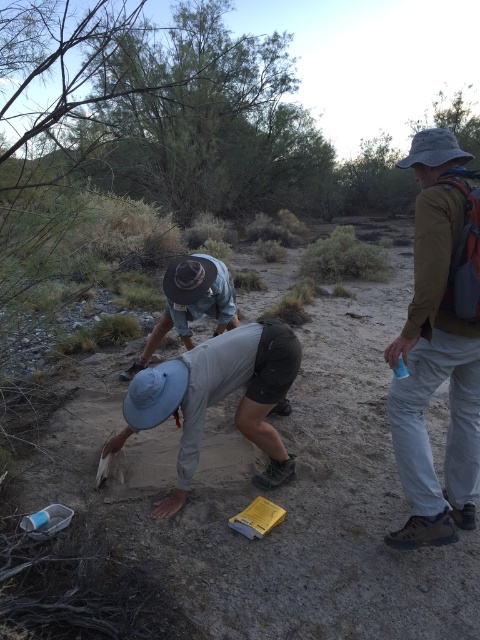
Question: Which point appears farthest from the camera in this image?

Choices:
 (A) (134, 392)
 (B) (176, 266)
 (C) (416, 420)

Answer: (B)

Question: Can you confirm if light gray fabric hat at center is smaller than denim shorts at center?

Choices:
 (A) no
 (B) yes

Answer: (B)

Question: From the image, what is the correct spatial relationship of greenish-yellow fabric backpack at right in relation to denim shorts at center?

Choices:
 (A) left
 (B) right

Answer: (B)

Question: Which is nearer to the denim shorts at center?

Choices:
 (A) light gray fabric hat at center
 (B) greenish-yellow fabric backpack at right

Answer: (A)

Question: Is light gray fabric hat at center wider than denim shorts at center?

Choices:
 (A) yes
 (B) no

Answer: (B)

Question: Which object appears closest to the camera in this image?

Choices:
 (A) denim shorts at center
 (B) light gray fabric hat at center
 (C) greenish-yellow fabric backpack at right

Answer: (C)